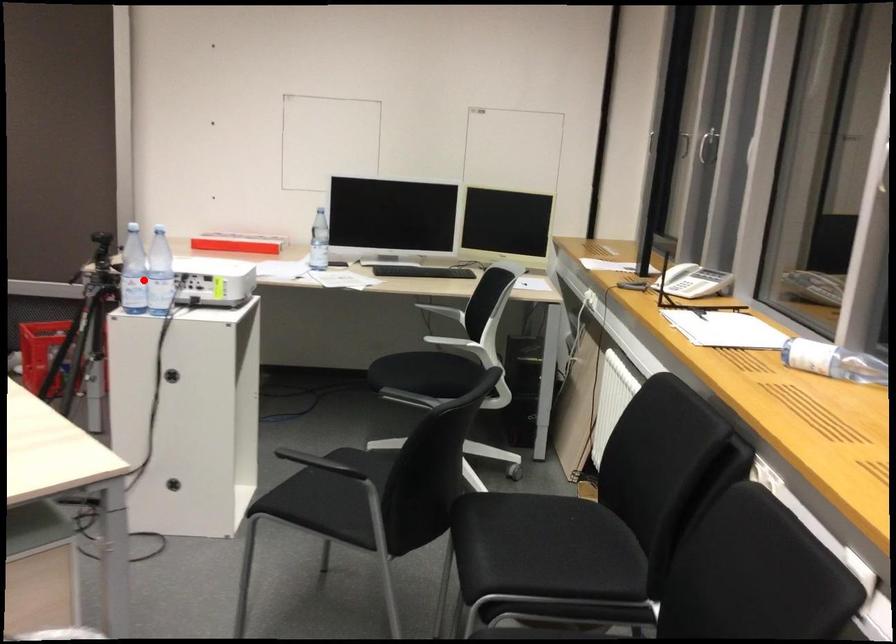
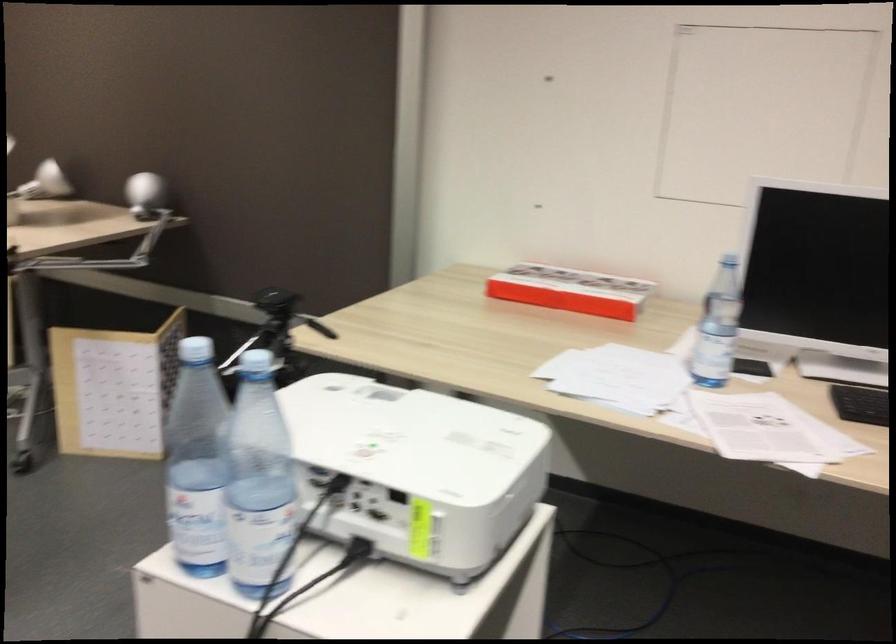
Where in the second image is the point corresponding to the highlighted location from the first image?

(259, 482)